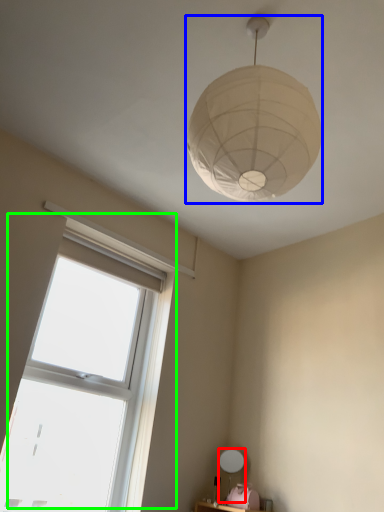
Question: Which is nearer to the table lamp (highlighted by a red box)? lamp (highlighted by a blue box) or window (highlighted by a green box).

Choices:
 (A) lamp
 (B) window

Answer: (B)